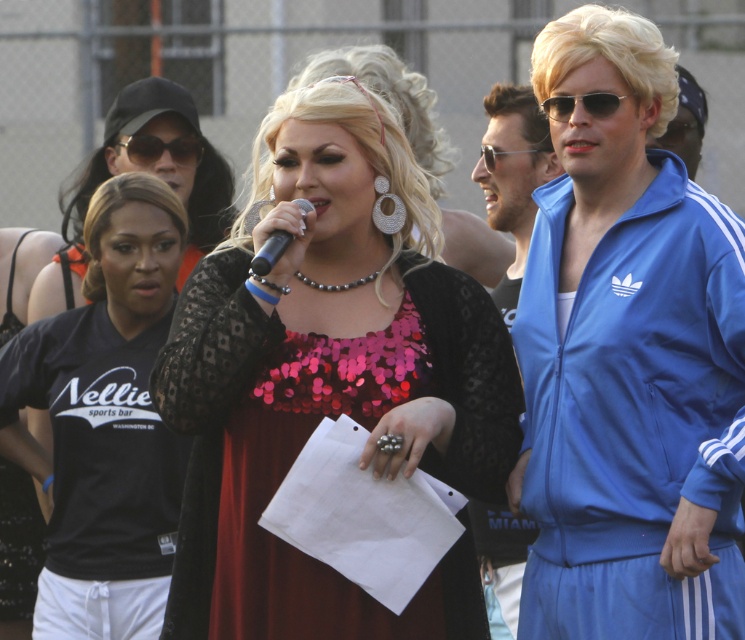
Question: Considering the relative positions of black plastic sunglasses at upper left and black plastic microphone at center in the image provided, where is black plastic sunglasses at upper left located with respect to black plastic microphone at center?

Choices:
 (A) below
 (B) above

Answer: (B)

Question: Considering the real-world distances, which object is farthest from the black plastic sunglasses at upper left?

Choices:
 (A) black plastic microphone at center
 (B) sequined fabric dress at center

Answer: (A)

Question: Does sequined fabric dress at center have a smaller size compared to black plastic microphone at center?

Choices:
 (A) yes
 (B) no

Answer: (B)

Question: Is black sequined dress at center in front of sunglasses at right?

Choices:
 (A) no
 (B) yes

Answer: (A)

Question: Estimate the real-world distances between objects in this image. Which object is closer to the black plastic microphone at center?

Choices:
 (A) sequined fabric dress at center
 (B) black sequined dress at center

Answer: (A)

Question: Which object is farther from the camera taking this photo?

Choices:
 (A) black plastic sunglasses at upper left
 (B) black plastic microphone at center

Answer: (A)